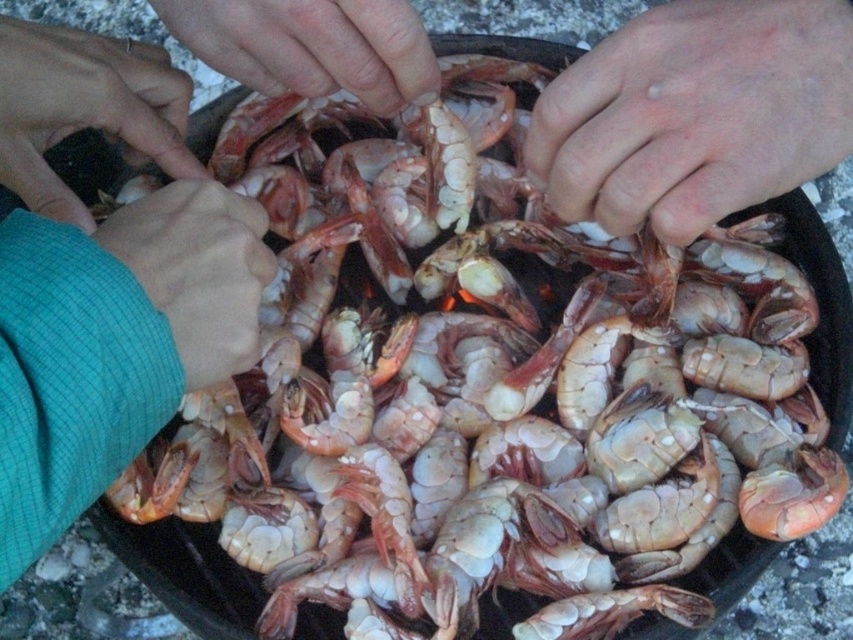
Question: Is dry skin at center above smooth skin hand at upper center?

Choices:
 (A) yes
 (B) no

Answer: (B)

Question: Which object is closer to the camera taking this photo?

Choices:
 (A) green textured sleeve at lower left
 (B) matte pink shrimp at left
 (C) dry skin at center
 (D) green fabric hand at lower left

Answer: (A)

Question: Estimate the real-world distances between objects in this image. Which object is closer to the green textured sleeve at lower left?

Choices:
 (A) green fabric hand at lower left
 (B) matte pink shrimp at left
 (C) smooth skin hand at upper center

Answer: (A)

Question: Which point appears farthest from the camera in this image?

Choices:
 (A) (234, 35)
 (B) (198, 58)
 (C) (692, 125)
 (D) (1, 131)

Answer: (B)

Question: Does smooth skin hand at upper center lie behind matte pink shrimp at left?

Choices:
 (A) no
 (B) yes

Answer: (B)

Question: In this image, where is smooth skin hand at upper center located relative to green textured sleeve at lower left?

Choices:
 (A) left
 (B) right

Answer: (B)